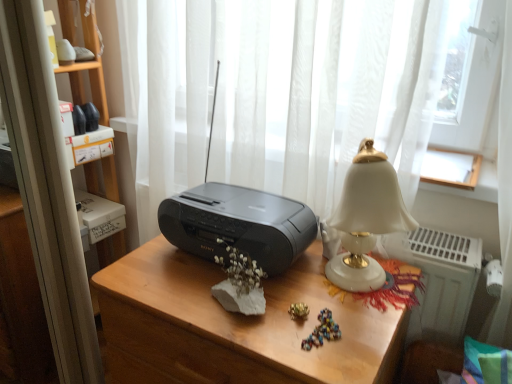
You are a GUI agent. You are given a task and a screenshot of the screen. Output one action in this format:
    pyautogui.click(x=<x>, y=<y>)
    Task: Click on the vacant region below white porcelain lamp at right (from a real-world perspective)
    This screenshot has width=512, height=384.
    Given the screenshot: What is the action you would take?
    pyautogui.click(x=339, y=293)